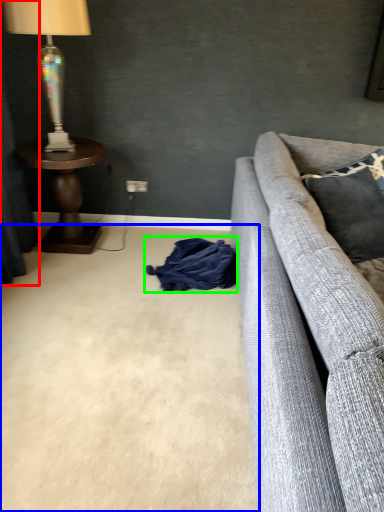
Question: Considering the real-world distances, which object is farthest from curtain (highlighted by a red box)? plain (highlighted by a blue box) or material (highlighted by a green box)?

Choices:
 (A) plain
 (B) material

Answer: (B)